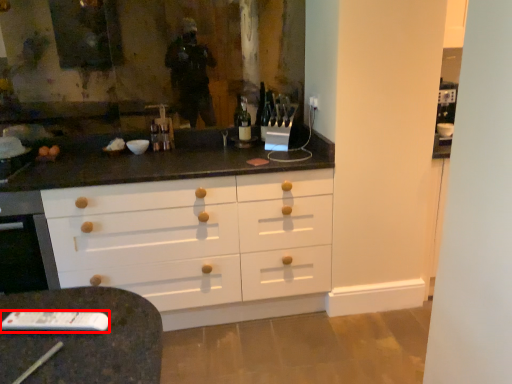
Question: From the image's perspective, where is remote (annotated by the red box) located relative to bottle?

Choices:
 (A) above
 (B) below

Answer: (B)